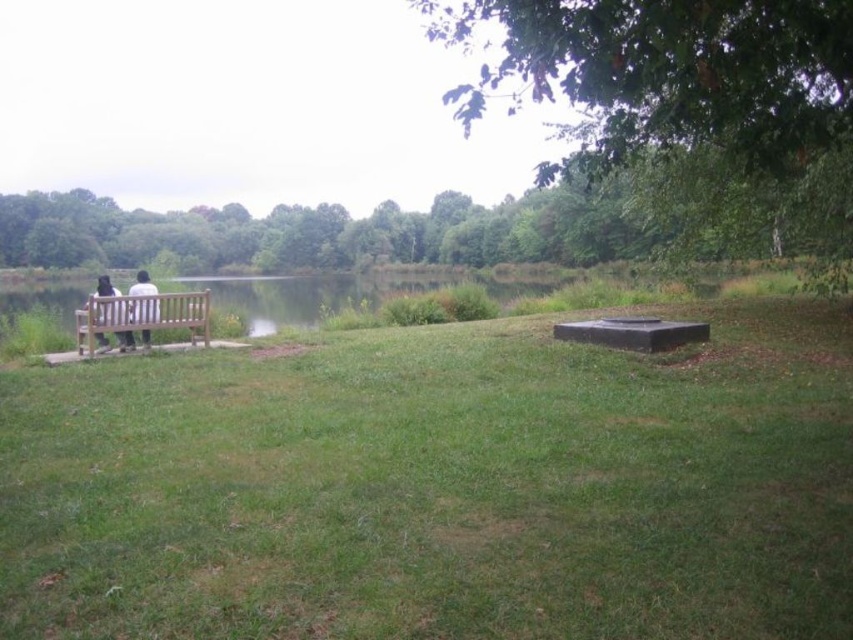
Question: Among these points, which one is nearest to the camera?

Choices:
 (A) (248, 417)
 (B) (532, 76)
 (C) (135, 280)
 (D) (131, 300)

Answer: (B)

Question: Does green leafy tree at upper center appear on the left side of white fabric shirt at left?

Choices:
 (A) no
 (B) yes

Answer: (B)

Question: Which object is farther from the camera taking this photo?

Choices:
 (A) green grassy at left
 (B) green leafy tree at upper center
 (C) dark brown leather jacket at left
 (D) green leafy tree at upper right

Answer: (C)

Question: Is green grassy at left thinner than wooden bench at left?

Choices:
 (A) yes
 (B) no

Answer: (B)

Question: Which object is farther from the camera taking this photo?

Choices:
 (A) green leafy tree at upper center
 (B) dark brown leather jacket at left
 (C) wooden bench at left

Answer: (B)

Question: Is green grassy at left closer to the viewer compared to green leafy tree at upper right?

Choices:
 (A) yes
 (B) no

Answer: (A)